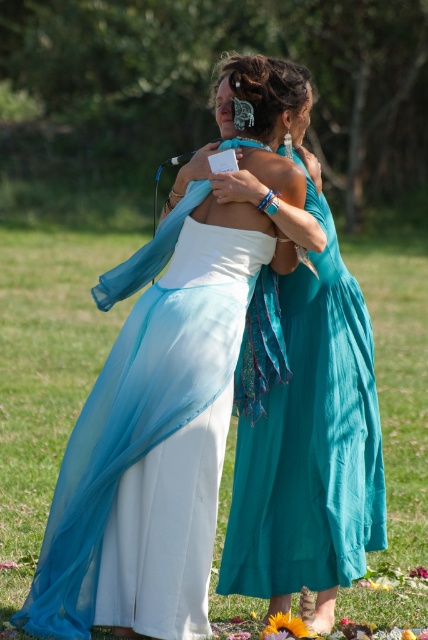
You are a photographer trying to capture a closeup of both the white satin dress at center and the teal chiffon dress at center. Since you can only focus on one dress at a time, which dress should you choose to ensure the other is still somewhat in focus due to its size?

The white satin dress at center is bigger than the teal chiffon dress at center, so focusing on the larger white satin dress at center would keep the smaller teal chiffon dress at center more in focus.

You are a photographer capturing a photo of the two people in the image. The white satin dress at center and the teal chiffon dress at center are both in the frame. If you want to ensure both dresses are clearly visible in the photo, what should you consider about their positions?

The white satin dress at center is only 14.44 inches away from the teal chiffon dress at center, so you should ensure there is enough focus and spacing between them to capture both dresses clearly without overlapping too much.